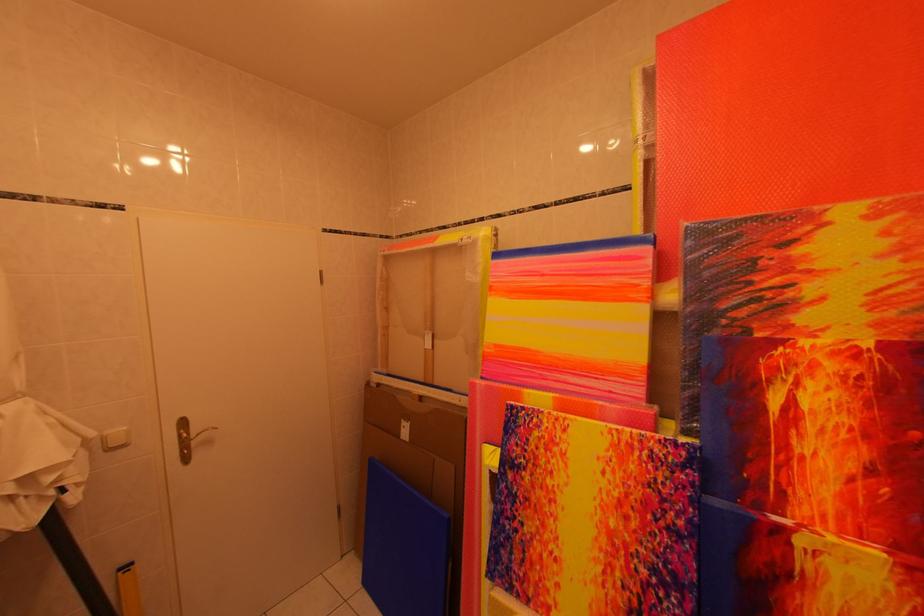
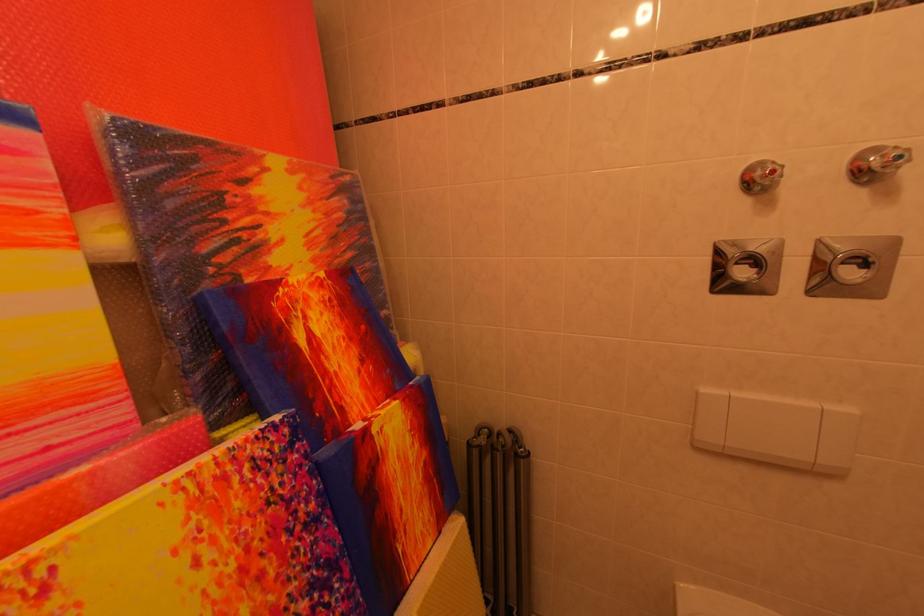
In the second image, find the point that corresponds to [759,286] in the first image.

(233, 225)